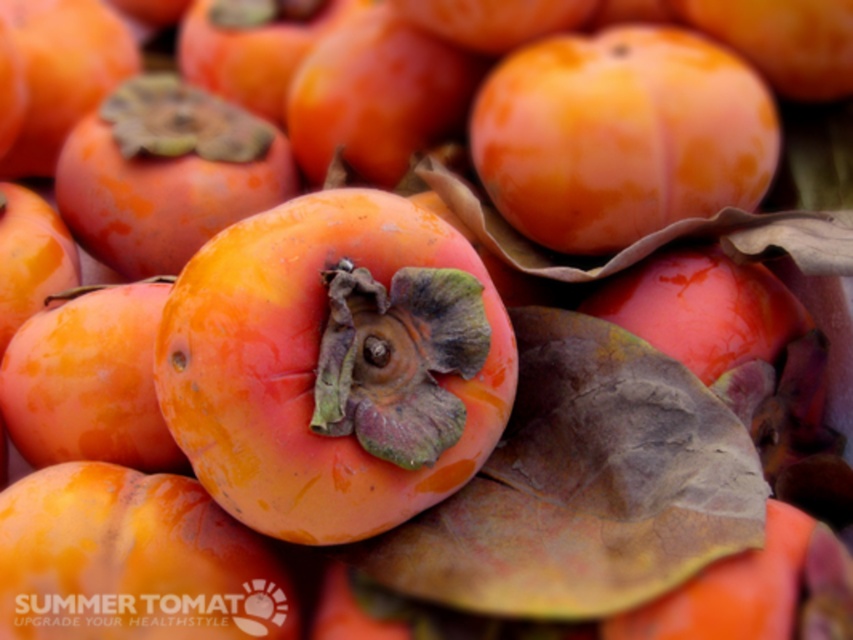
Who is higher up, glossy orange persimmon at center or matte orange apricot at center?

Positioned higher is matte orange apricot at center.

Locate an element on the screen. This screenshot has width=853, height=640. glossy orange persimmon at center is located at coordinates (334, 365).

Where is `glossy orange persimmon at center`? The height and width of the screenshot is (640, 853). glossy orange persimmon at center is located at coordinates (334, 365).